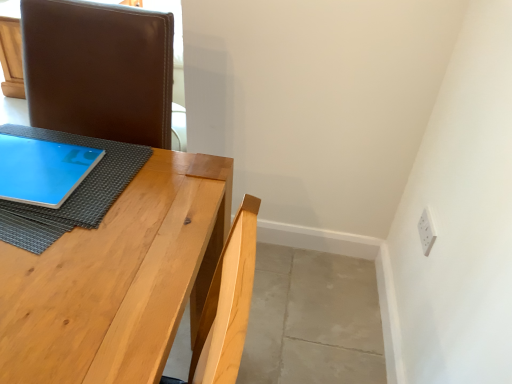
Question: Is matte blue tablet at left next to natural wood table at center?

Choices:
 (A) yes
 (B) no

Answer: (B)

Question: Is matte blue tablet at left to the right of natural wood table at center from the viewer's perspective?

Choices:
 (A) yes
 (B) no

Answer: (B)

Question: From the image's perspective, would you say matte blue tablet at left is positioned over natural wood table at center?

Choices:
 (A) yes
 (B) no

Answer: (A)

Question: Is matte blue tablet at left closer to camera compared to natural wood table at center?

Choices:
 (A) no
 (B) yes

Answer: (A)

Question: Is matte blue tablet at left further to the viewer compared to natural wood table at center?

Choices:
 (A) yes
 (B) no

Answer: (A)

Question: In terms of height, does matte blue tablet at left look taller or shorter compared to natural wood table at center?

Choices:
 (A) tall
 (B) short

Answer: (B)

Question: From a real-world perspective, is matte blue tablet at left above or below natural wood table at center?

Choices:
 (A) above
 (B) below

Answer: (A)

Question: Relative to natural wood table at center, is matte blue tablet at left in front or behind?

Choices:
 (A) behind
 (B) front

Answer: (A)

Question: Based on their sizes in the image, would you say matte blue tablet at left is bigger or smaller than natural wood table at center?

Choices:
 (A) big
 (B) small

Answer: (B)

Question: From the image's perspective, is white plastic electric outlet at upper right positioned above or below natural wood table at center?

Choices:
 (A) below
 (B) above

Answer: (B)

Question: Considering the positions of white plastic electric outlet at upper right and natural wood table at center in the image, is white plastic electric outlet at upper right taller or shorter than natural wood table at center?

Choices:
 (A) short
 (B) tall

Answer: (A)

Question: In terms of size, does white plastic electric outlet at upper right appear bigger or smaller than natural wood table at center?

Choices:
 (A) big
 (B) small

Answer: (B)

Question: In the image, is white plastic electric outlet at upper right on the left side or the right side of natural wood table at center?

Choices:
 (A) left
 (B) right

Answer: (B)

Question: Based on their sizes in the image, would you say natural wood table at center is bigger or smaller than blue fabric at upper left?

Choices:
 (A) big
 (B) small

Answer: (A)

Question: From a real-world perspective, relative to blue fabric at upper left, is natural wood table at center vertically above or below?

Choices:
 (A) below
 (B) above

Answer: (A)